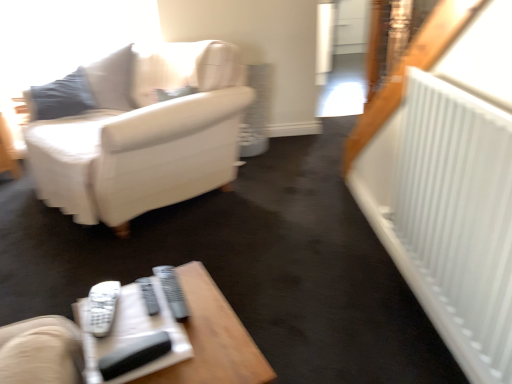
Question: In terms of height, does wooden table at lower center look taller or shorter compared to white plastic remote at lower center, the first remote from the left?

Choices:
 (A) short
 (B) tall

Answer: (B)

Question: From the image's perspective, relative to white plastic remote at lower center, the first remote from the left, is wooden table at lower center above or below?

Choices:
 (A) above
 (B) below

Answer: (B)

Question: Which object is positioned closest to the white leather couch at upper left?

Choices:
 (A) wooden table at lower center
 (B) white plastic remote at lower center, the first remote from the left
 (C) gray plastic remote at center, which is the second remote in left-to-right order

Answer: (B)

Question: Estimate the real-world distances between objects in this image. Which object is closer to the wooden table at lower center?

Choices:
 (A) gray plastic remote at center, which is the second remote in left-to-right order
 (B) white plastic remote at lower center, the first remote from the left
 (C) white leather couch at upper left

Answer: (A)